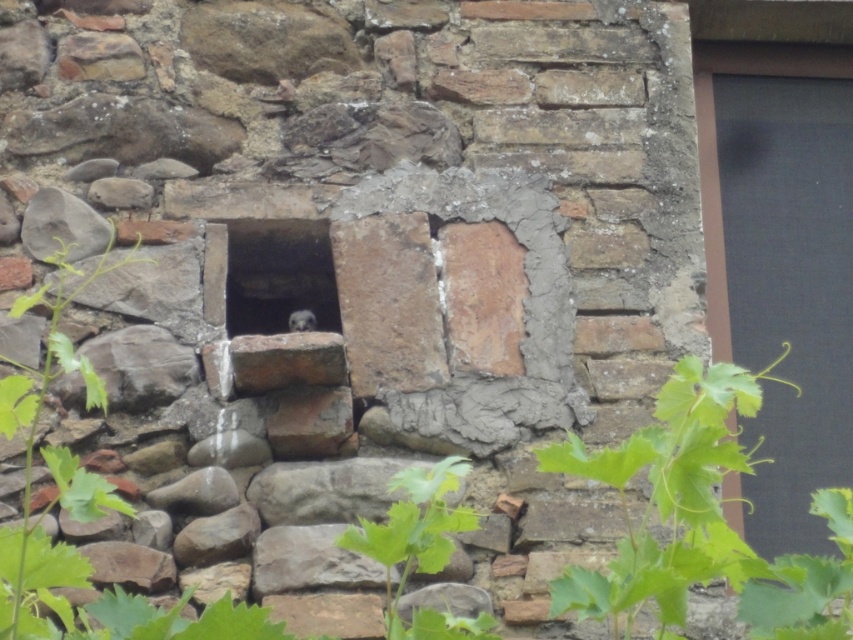
You are an architect inspecting an old building. You notice a matte black window at right and a smooth stone hole at center. Which of these two features is taller?

The matte black window at right is much taller than the smooth stone hole at center.

You are an architect examining an old stone wall. You notice a matte black window at right and a smooth stone hole at center. Which of these two features has a greater width?

The matte black window at right is larger in size than the smooth stone hole at center, so the matte black window at right has a greater width.

You are standing in front of the weathered stone wall and want to locate the matte black window at right. According to the coordinates provided, where should you look relative to the center of the image?

The matte black window at right is located at coordinates point 0.373 on the x axis and 0.916 on the y axis, which means it is positioned to the left and slightly below the center of the image.